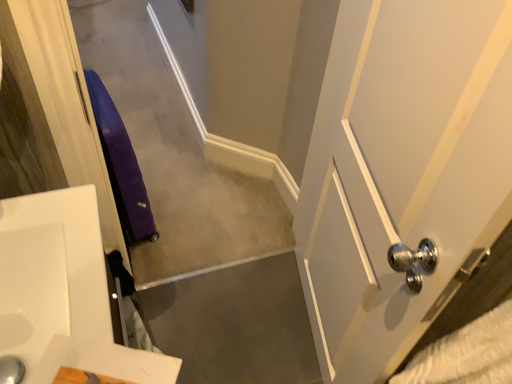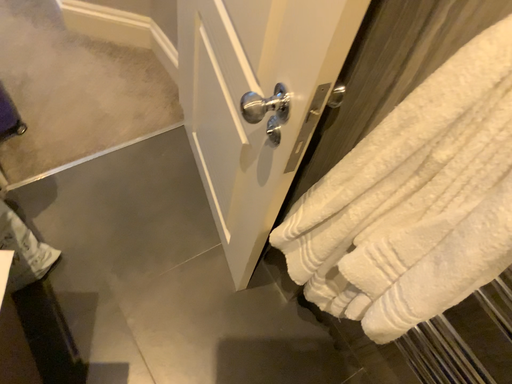
Question: Which way did the camera rotate in the video?

Choices:
 (A) rotated left
 (B) rotated right

Answer: (B)